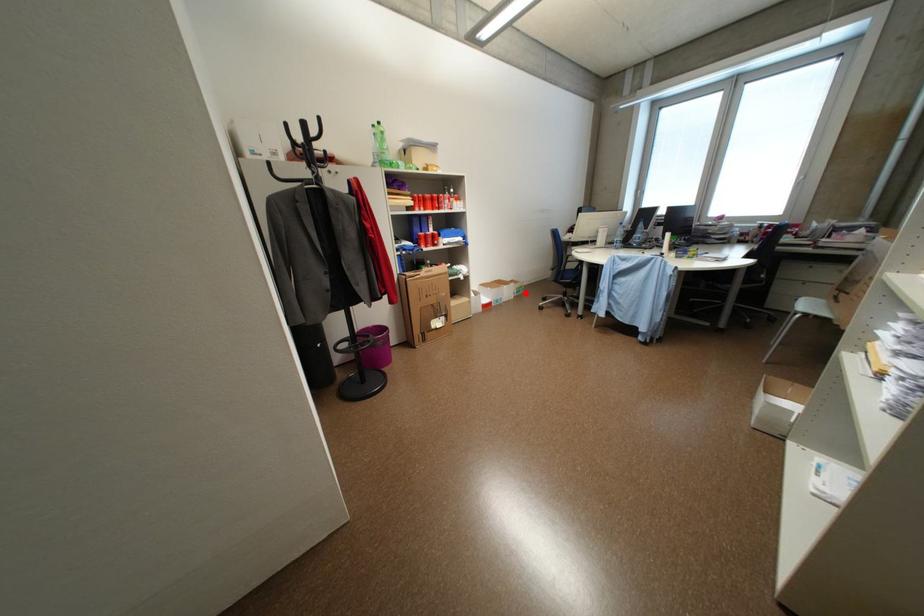
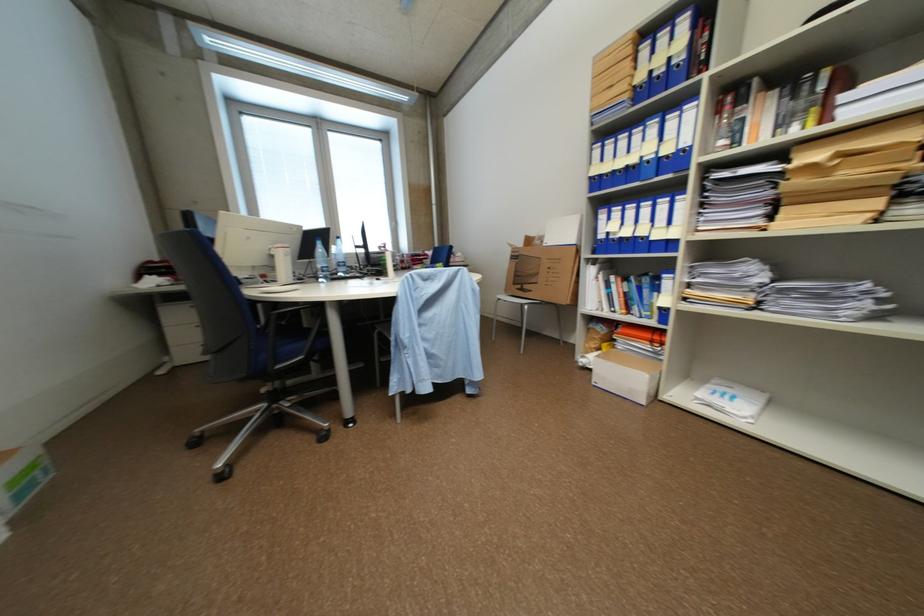
The point at the highlighted location is marked in the first image. Where is the corresponding point in the second image?

(28, 496)